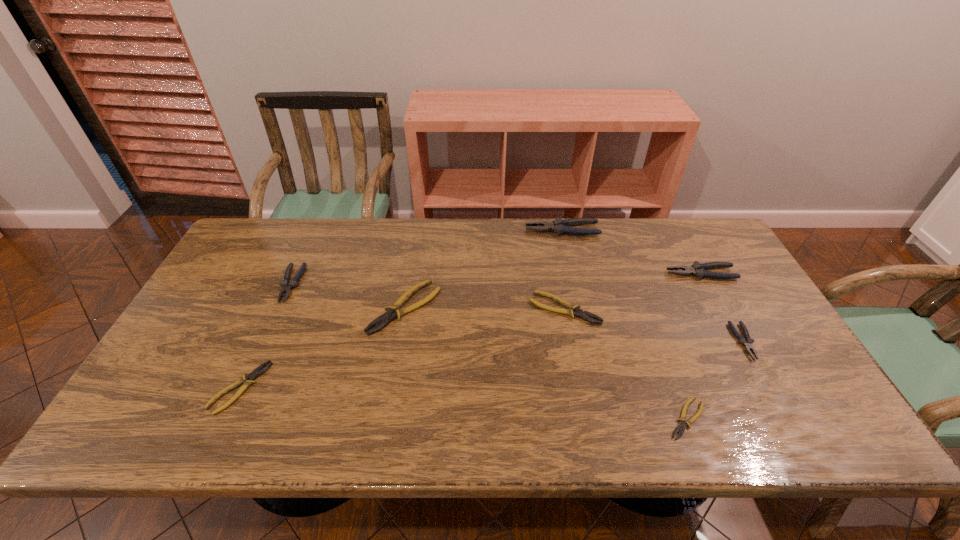
The width and height of the screenshot is (960, 540). I want to click on the leftmost yellow pliers, so click(258, 371).

Where is `the rightmost yellow pliers`? the rightmost yellow pliers is located at coordinates point(681,427).

Identify the location of the shortest object. (681, 427).

Identify the location of free space located at the gripping part of the farthest pliers. (508, 230).

At what (x,y) coordinates should I click in order to perform the action: click on blank space located 0.270m at the gripping part of the farthest pliers. Please return your answer as a coordinate pair (x, y). The image size is (960, 540). Looking at the image, I should click on (446, 230).

Locate an element on the screen. The image size is (960, 540). vacant area situated 0.270m at the gripping part of the farthest pliers is located at coordinates (446, 230).

The width and height of the screenshot is (960, 540). Identify the location of free point located at the gripping part of the second tallest object. (601, 273).

The height and width of the screenshot is (540, 960). Identify the location of free region located 0.060m at the gripping part of the second tallest object. (647, 273).

This screenshot has width=960, height=540. In order to click on free space located at the gripping part of the second tallest object in this screenshot , I will do `click(591, 273)`.

This screenshot has height=540, width=960. I want to click on free space located 0.180m at the gripping part of the leftmost gray pliers, so click(258, 356).